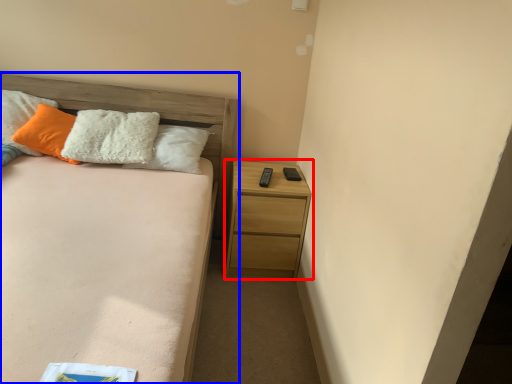
Question: Among these objects, which one is farthest to the camera, nightstand (highlighted by a red box) or bed (highlighted by a blue box)?

Choices:
 (A) nightstand
 (B) bed

Answer: (A)